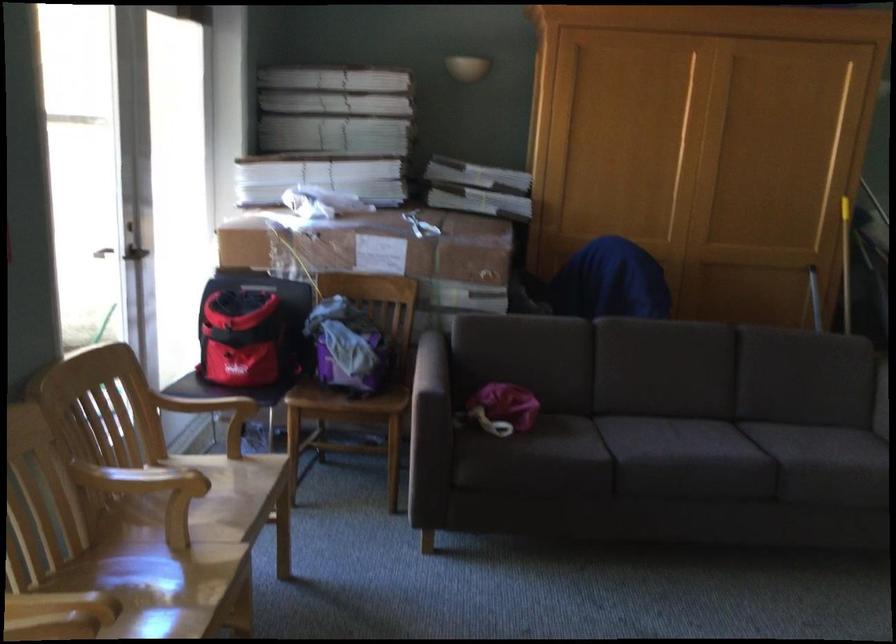
At what (x,y) coordinates should I click in order to perform the action: click on sofa armrest. Please return your answer as a coordinate pair (x, y). The height and width of the screenshot is (644, 896). Looking at the image, I should click on (431, 365).